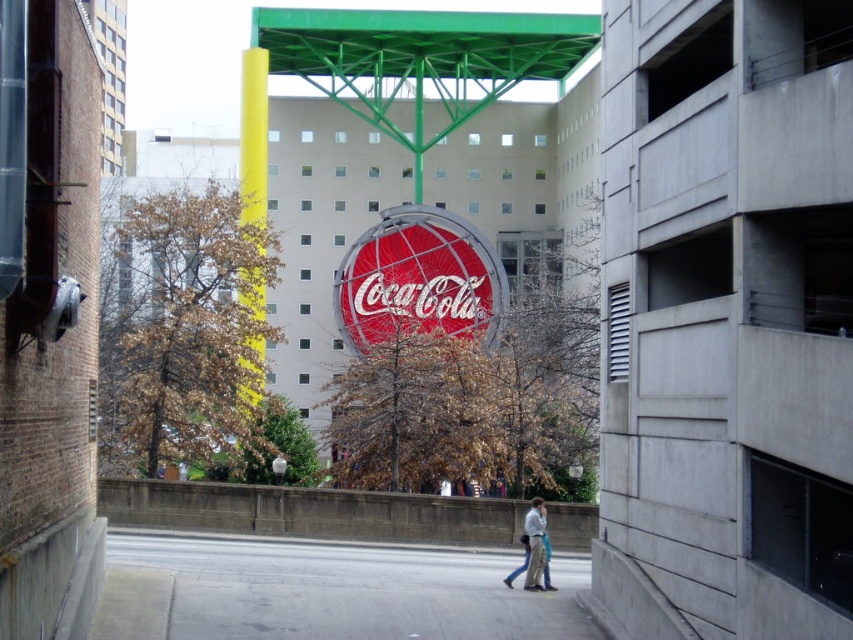
You are standing in the urban scene described. You see a point marked at coordinates (535, 544). What object is located at that point?

The point at coordinates (535, 544) indicates light blue jeans at center.